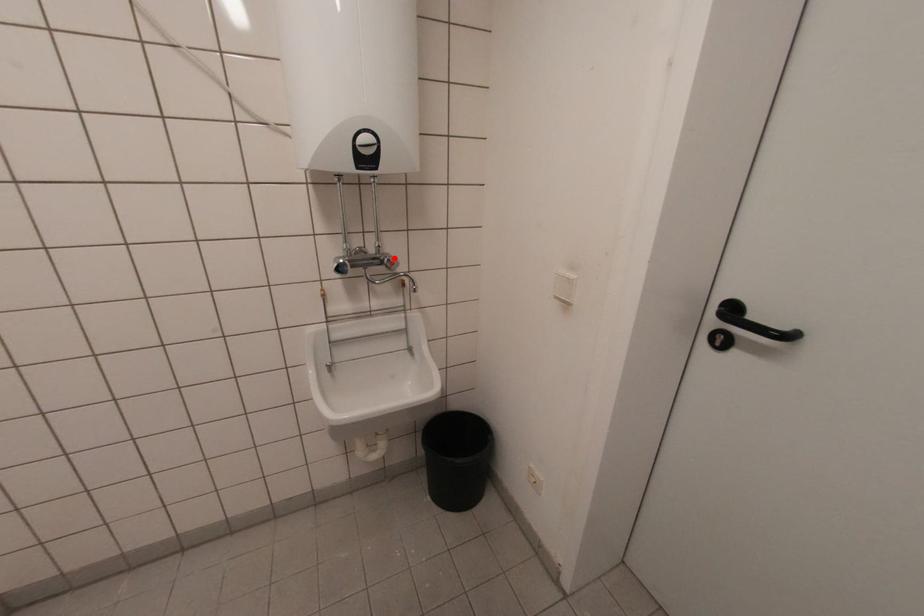
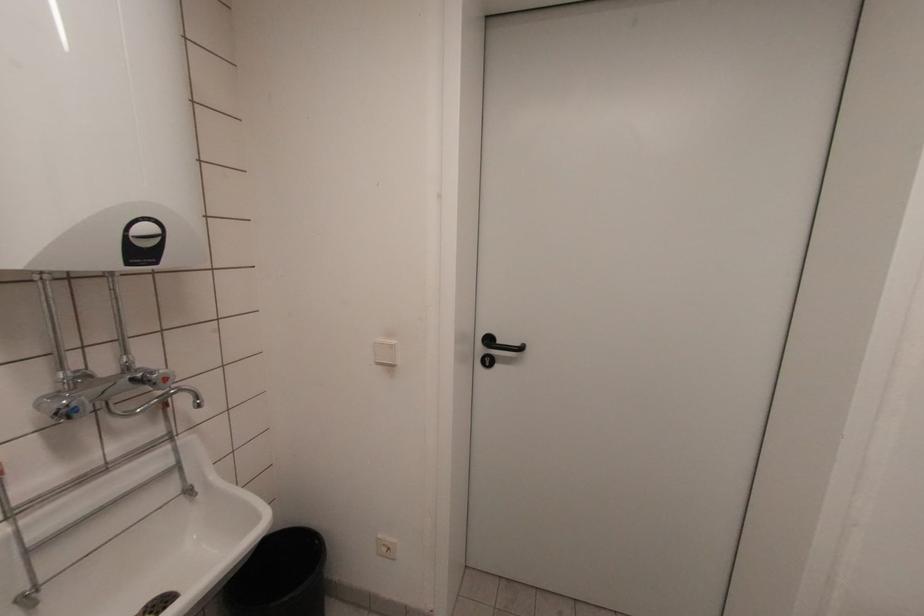
In the second image, find the point that corresponds to the highlighted location in the first image.

(163, 371)